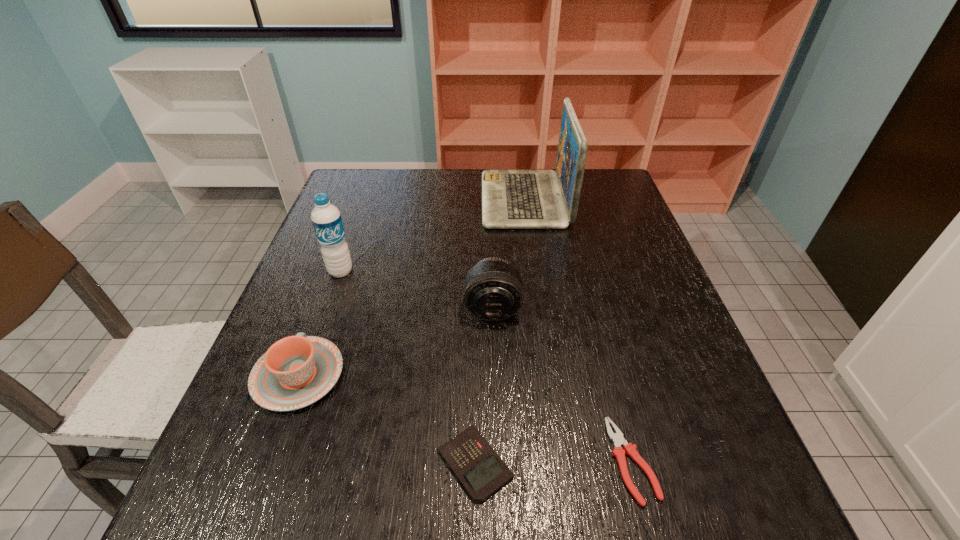
Identify the location of blank area located on the screen of the tallest object. The height and width of the screenshot is (540, 960). (397, 200).

This screenshot has height=540, width=960. Identify the location of free space located on the screen of the tallest object. (401, 200).

This screenshot has width=960, height=540. I want to click on free point located on the screen of the tallest object, so click(x=423, y=200).

Identify the location of vacant area situated on the label of the water bottle. (284, 429).

Find the location of a particular element. This screenshot has width=960, height=540. vacant space positioned on the front-facing side of the telephoto lens is located at coordinates (499, 520).

Locate an element on the screen. This screenshot has height=540, width=960. free location located on the handle side of the chinaware is located at coordinates (343, 255).

The image size is (960, 540). Identify the location of vacant space situated 0.290m on the handle side of the chinaware. (343, 255).

At what (x,y) coordinates should I click in order to perform the action: click on vacant area situated on the handle side of the chinaware. Please return your answer as a coordinate pair (x, y). The image size is (960, 540). Looking at the image, I should click on (341, 260).

In order to click on vacant space positioned on the back of the calculator in this screenshot , I will do `click(476, 341)`.

The image size is (960, 540). In order to click on free space located 0.120m on the right of the pliers in this screenshot , I will do `click(722, 461)`.